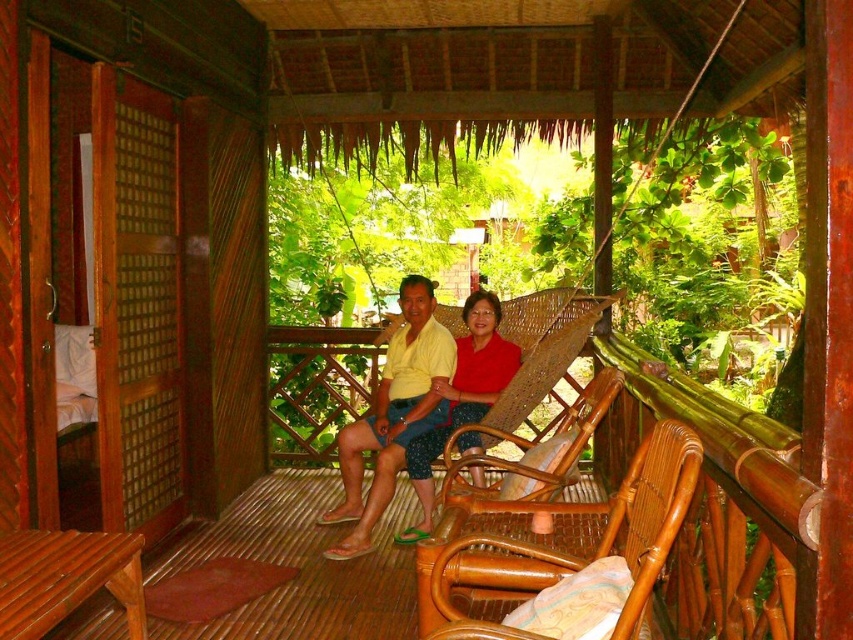
Is rattan chair at center closer to camera compared to woven rattan chair at center?

Yes, it is.

Does rattan chair at center have a smaller size compared to woven rattan chair at center?

No.

This screenshot has width=853, height=640. I want to click on rattan chair at center, so click(x=572, y=557).

The width and height of the screenshot is (853, 640). What do you see at coordinates (393, 413) in the screenshot? I see `yellow matte shirt at center` at bounding box center [393, 413].

Who is more forward, [357,476] or [573,422]?

Positioned in front is point [357,476].

Who is more forward, (422, 324) or (546, 474)?

Answer: Positioned in front is point (546, 474).

The height and width of the screenshot is (640, 853). Identify the location of yellow matte shirt at center. (393, 413).

Which is more to the left, rattan chair at center or matte red blouse at center?

matte red blouse at center

Does rattan chair at center appear on the left side of matte red blouse at center?

No, rattan chair at center is not to the left of matte red blouse at center.

The width and height of the screenshot is (853, 640). What are the coordinates of `rattan chair at center` in the screenshot? It's located at (572, 557).

You are a GUI agent. You are given a task and a screenshot of the screen. Output one action in this format:
    pyautogui.click(x=<x>, y=<y>)
    Task: Click on the rattan chair at center
    
    Given the screenshot: What is the action you would take?
    pyautogui.click(x=572, y=557)